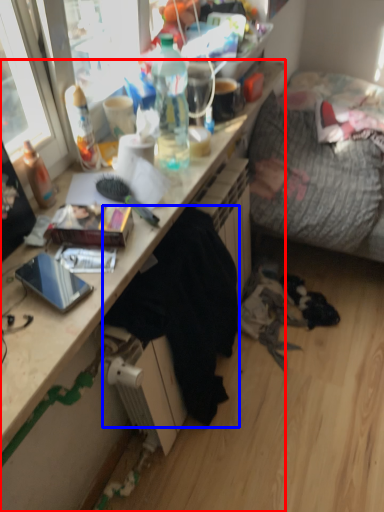
Question: Which point is closer to the camera, desk (highlighted by a red box) or clothing (highlighted by a blue box)?

Choices:
 (A) desk
 (B) clothing

Answer: (A)